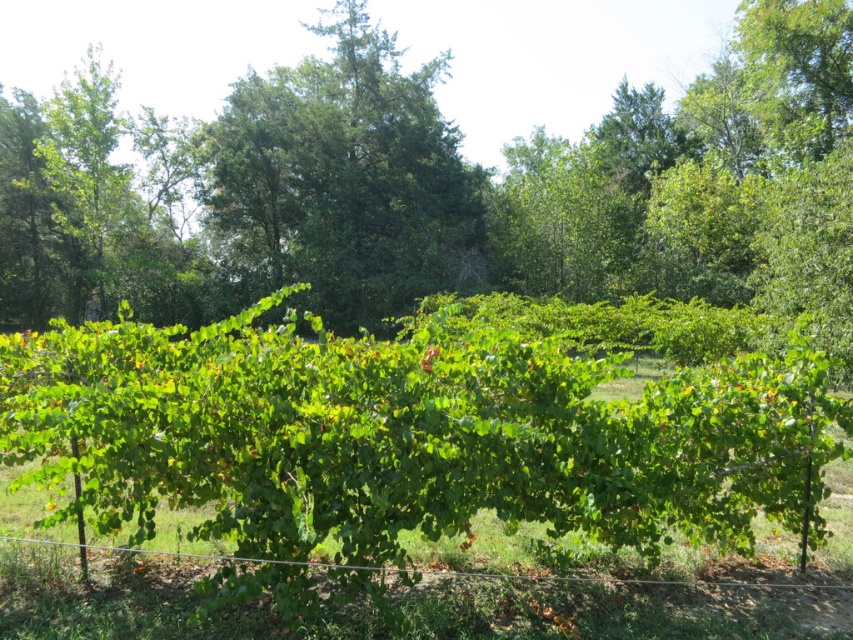
Based on the photo, you are a gardener standing at the edge of the vineyard looking towards the green leafy bush at center and the wire at lower center. Which object is closer to you?

The green leafy bush at center is closer to you than the wire at lower center because the wire at lower center is positioned behind it.

You are a gardener planning to place a decorative stone between the green leafy bush at center and the wire at lower center. Given their widths, which object requires a wider space to accommodate the stone placement?

The green leafy bush at center requires a wider space because its width surpasses that of the wire at lower center.

You are a gardener planning to plant a new tree in the vineyard. You see the green leafy tree at center and the wire at lower center. Which object is bigger in size?

The green leafy tree at center is larger in size than the wire at lower center.